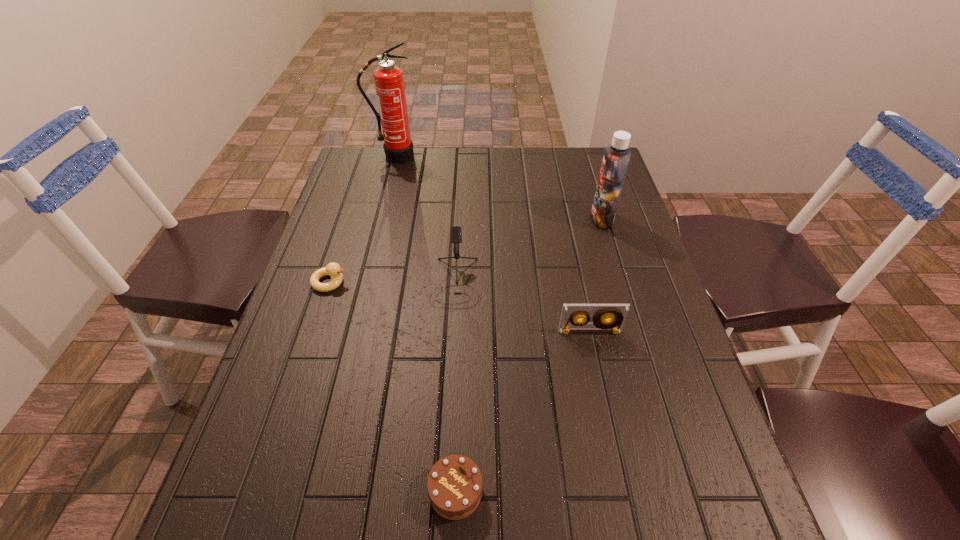
Find the location of a particular element. This screenshot has height=540, width=960. free spot between the duckling and the videotape is located at coordinates (460, 307).

At what (x,y) coordinates should I click in order to perform the action: click on free space between the duckling and the chocolate cake. Please return your answer as a coordinate pair (x, y). Looking at the image, I should click on (393, 387).

The image size is (960, 540). What are the coordinates of `free space between the third shortest object and the duckling` in the screenshot? It's located at (460, 307).

This screenshot has height=540, width=960. Find the location of `free spot between the farthest object and the third shortest object`. free spot between the farthest object and the third shortest object is located at coordinates (492, 244).

Identify the location of unoccupied area between the videotape and the chocolate cake. This screenshot has height=540, width=960. (522, 411).

Where is `free spot between the fire extinguisher and the nearest object`? The height and width of the screenshot is (540, 960). free spot between the fire extinguisher and the nearest object is located at coordinates (425, 324).

At what (x,y) coordinates should I click in order to perform the action: click on free spot between the duckling and the fourth shortest object. Please return your answer as a coordinate pair (x, y). This screenshot has width=960, height=540. Looking at the image, I should click on (393, 282).

The image size is (960, 540). I want to click on object that ranks as the closest to the videotape, so click(x=456, y=234).

Locate which object is the closest to the chocolate cake. Please provide its 2D coordinates. Your answer should be formatted as a tuple, i.e. [(x, y)], where the tuple contains the x and y coordinates of a point satisfying the conditions above.

[(616, 313)]

Find the location of `vacant space that satisfies the following two spatial constraints: 1. on the front label of the rightmost object; 2. on the stand of the third tallest object`. vacant space that satisfies the following two spatial constraints: 1. on the front label of the rightmost object; 2. on the stand of the third tallest object is located at coordinates (621, 281).